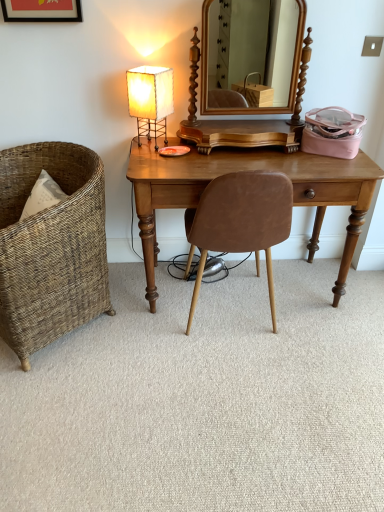
Locate an element on the screen. free space to the right of woven wicker chair at left, arranged as the second chair when viewed from the right is located at coordinates (155, 338).